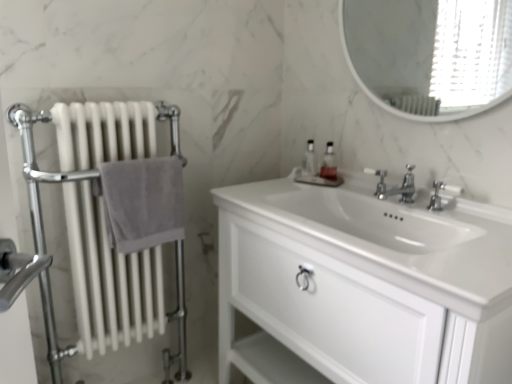
The image size is (512, 384). Find the location of `free space between chrome metallic faucet at center, arranged as the second tap when viewed from the right, and polished chrome faucet at center`. free space between chrome metallic faucet at center, arranged as the second tap when viewed from the right, and polished chrome faucet at center is located at coordinates (375, 199).